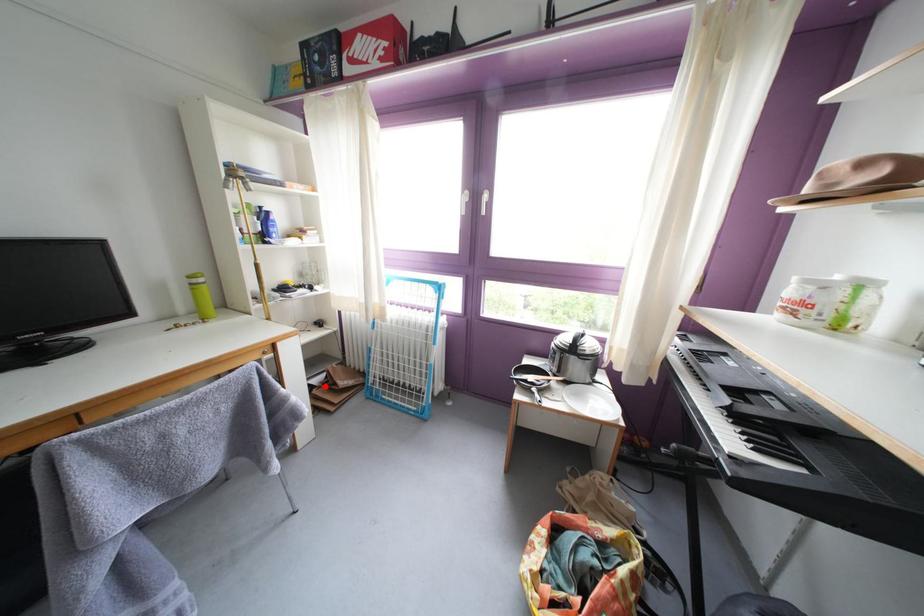
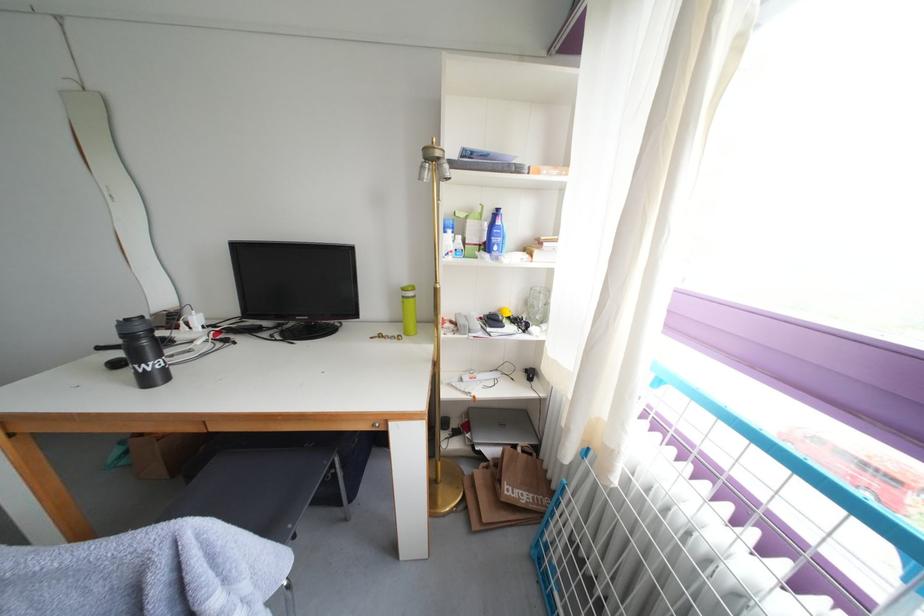
Question: I am providing you with two images of the same scene from different viewpoints. In image1, a red point is highlighted. Considering the same 3D point in image2, which of the following is correct?

Choices:
 (A) It is closer
 (B) It is farther

Answer: (B)